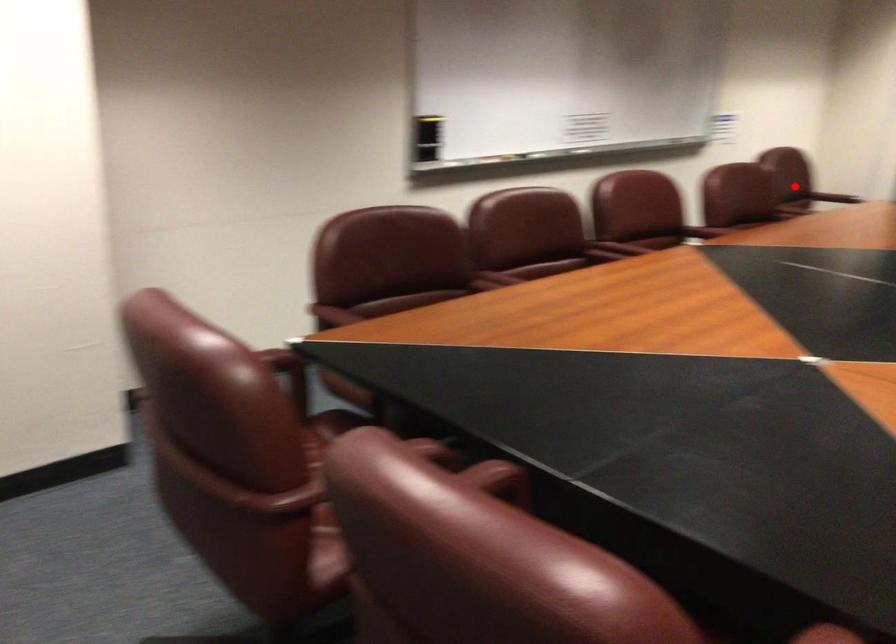
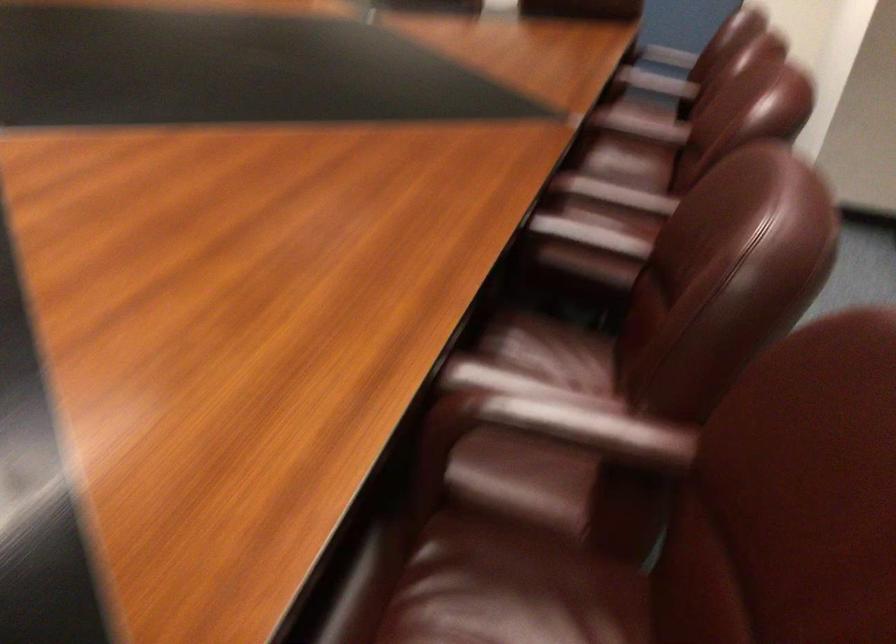
Find the pixel in the second image that matches the highlighted location in the first image.

(579, 428)